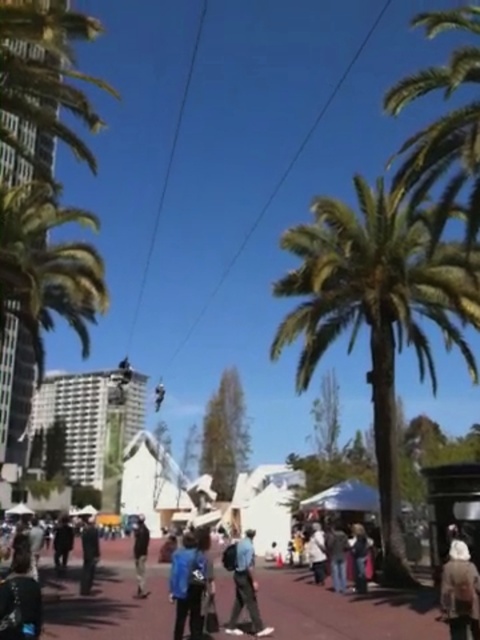
You are a photographer trying to capture a photo of both the white woolen hat at lower right and the dark blue jacket at lower left in the same frame. Given their sizes, which object should you focus on first to ensure both are clearly visible in your shot?

The white woolen hat at lower right is larger in size compared to the dark blue jacket at lower left. To ensure both are clearly visible, focus on the white woolen hat at lower right first as it requires more space in the frame.

You are a delivery person needing to place a large package on the ground. You see the paved asphalt at center and the dark blue jacket at center. Which surface can accommodate the package better?

The dark blue jacket at center is larger than the paved asphalt at center, so the package should be placed on the dark blue jacket at center.